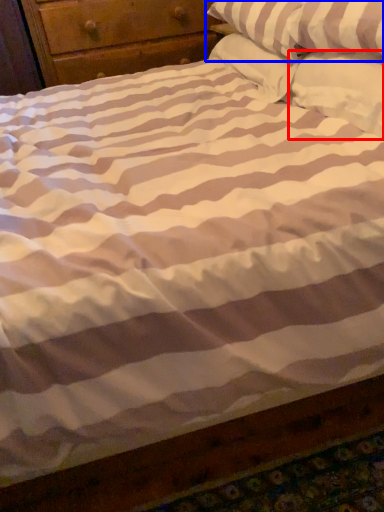
Question: Which of the following is the farthest to the observer, pillow (highlighted by a red box) or pillow (highlighted by a blue box)?

Choices:
 (A) pillow
 (B) pillow

Answer: (B)